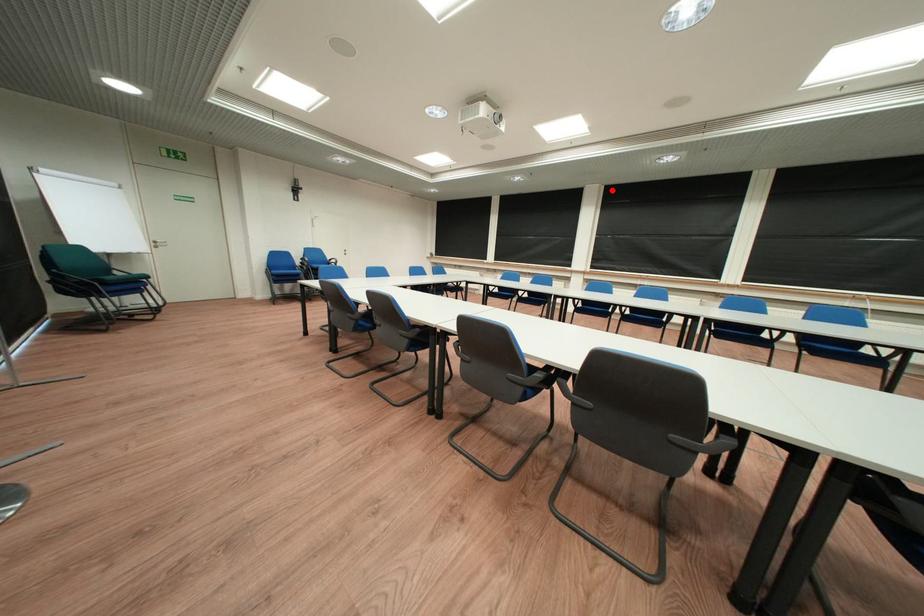
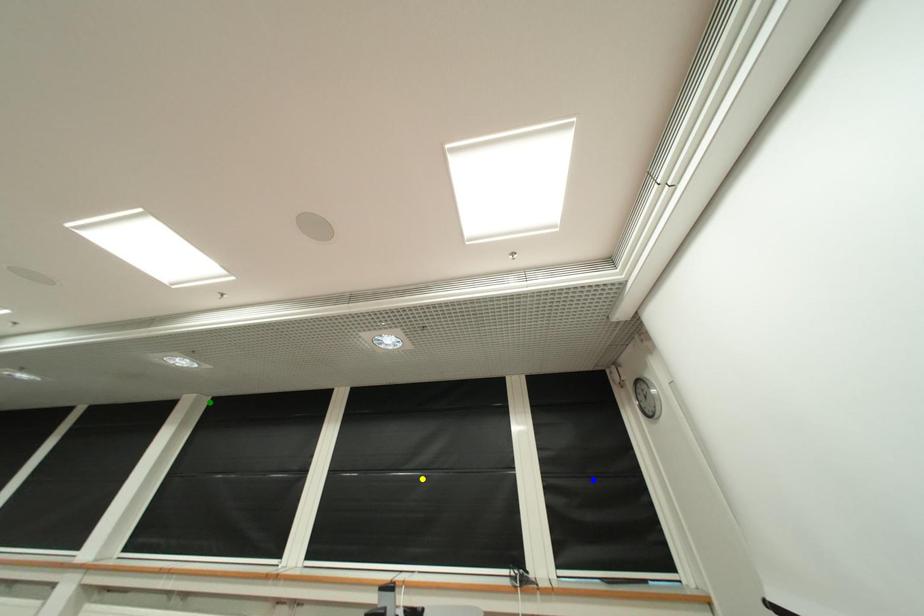
Question: I am providing you with two images of the same scene from different viewpoints. A red point is marked on the first image. You are given multiple points on the second image. Which point in image 2 is actually the same real-world point as the red point in image 1?

Choices:
 (A) blue point
 (B) yellow point
 (C) green point

Answer: (C)